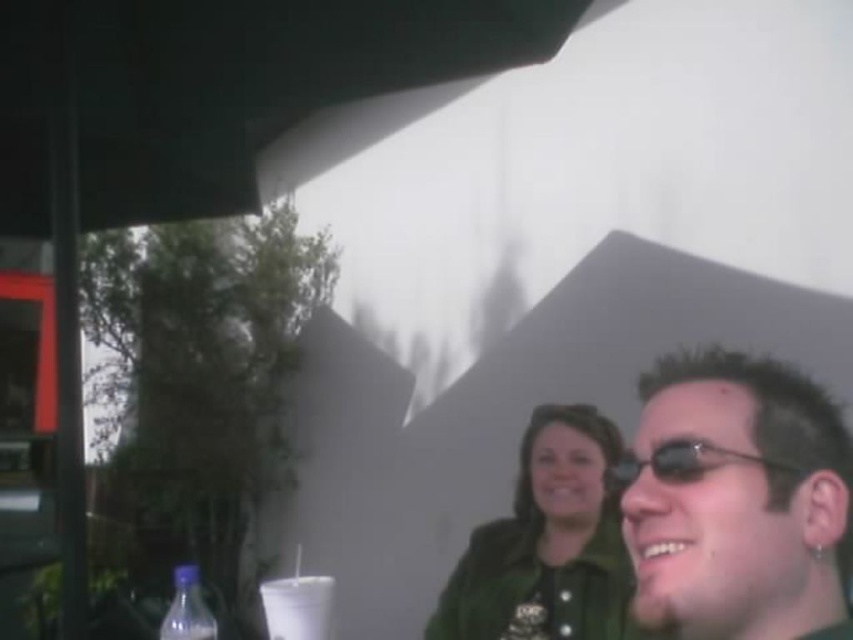
Question: Which object is closer to the camera taking this photo?

Choices:
 (A) shiny black sunglasses at right
 (B) white plastic cup at lower center
 (C) translucent plastic bottle at lower left
 (D) sunglasses at right

Answer: (A)

Question: Does shiny black sunglasses at right have a greater width compared to white plastic cup at lower center?

Choices:
 (A) yes
 (B) no

Answer: (A)

Question: Estimate the real-world distances between objects in this image. Which object is closer to the shiny black sunglasses at right?

Choices:
 (A) sunglasses at right
 (B) green matte jacket at center

Answer: (A)

Question: Is shiny black sunglasses at right positioned at the back of white plastic cup at lower center?

Choices:
 (A) no
 (B) yes

Answer: (A)

Question: Which object is farther from the camera taking this photo?

Choices:
 (A) sunglasses at right
 (B) white plastic cup at lower center
 (C) shiny black sunglasses at right

Answer: (B)

Question: Is shiny black sunglasses at right closer to the viewer compared to translucent plastic bottle at lower left?

Choices:
 (A) yes
 (B) no

Answer: (A)